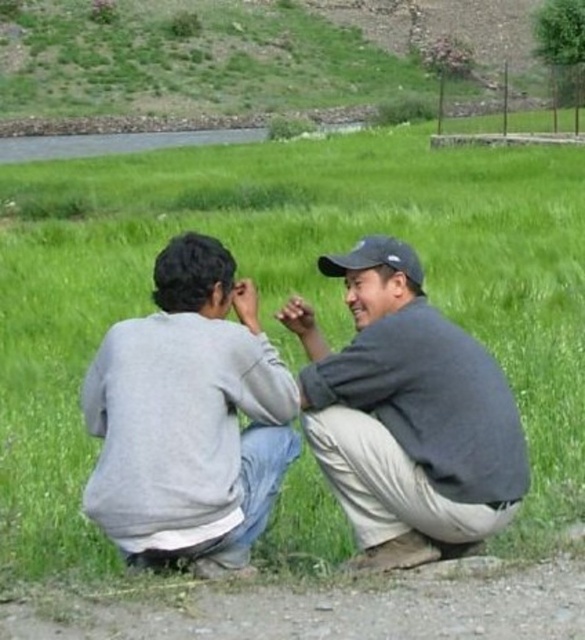
You are taking a photo of two people crouching on a grassy area. The first person is at point (355, 464) and the second person is at point (397, 253). If you want to focus on the person closer to the camera, which point should you adjust your camera focus to?

You should focus on point (355, 464) because it is closer to the camera than point (397, 253).

You are a photographer trying to capture a candid shot of the two people in the image. You notice that the gray cotton sweatshirt at center and the gray cotton shirt at center are overlapping slightly. Which clothing item do you need to adjust to ensure both are fully visible in the photo?

The gray cotton sweatshirt at center has a lesser width compared to gray cotton shirt at center. Therefore, you should adjust the gray cotton sweatshirt at center since it is narrower and might be covering part of the gray cotton shirt at center.